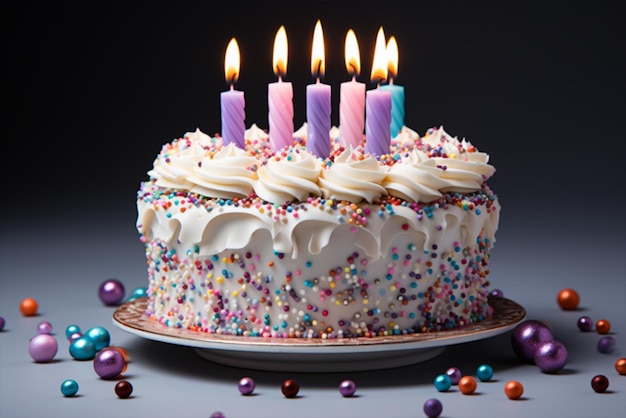
Locate an element on the screen. The image size is (626, 418). birthday candle is located at coordinates (233, 107), (275, 105), (315, 104), (352, 111), (384, 115), (394, 95).